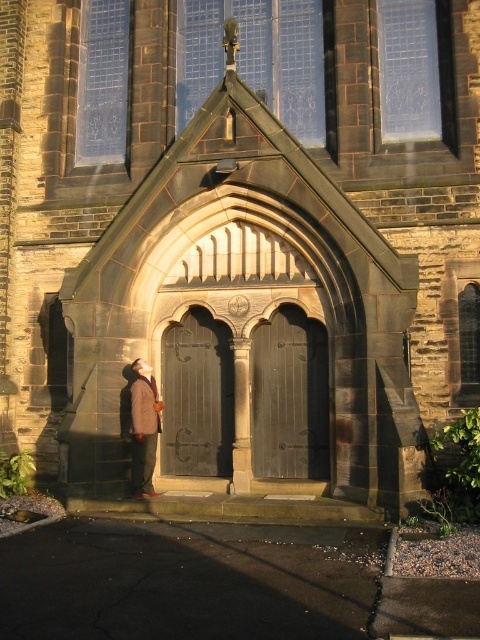
You are standing at the entrance of the Gothic church and notice two points marked on the stonework near the arched doorway. The first point is at coordinates point (231, 365) and the second is at point (137, 369). Which point is closer to you as you face the church entrance?

Point (231, 365) is closer to you because it is further to the viewer than point (137, 369).

You are standing at the entrance of a Gothic church and want to take a photo of the dark brown wooden door at center. If your camera has a maximum focus range of 50 feet, will you need to move closer to capture a clear image?

The dark brown wooden door at center is 57.86 feet away from camera, which exceeds the camera maximum focus range of 50 feet. You need to move closer to capture a clear image.

You are a delivery person with a 2.0 meter long package. You need to carry it through the entrance of the Gothic church. The package is too long to carry it horizontally. Can you walk through the entrance while holding the package vertically between the dark brown wooden door at center and the brown wool coat at lower left?

The distance between the dark brown wooden door at center and the brown wool coat at lower left is 2.40 meters. Since the package is 2.0 meters long, it can fit vertically within this space.